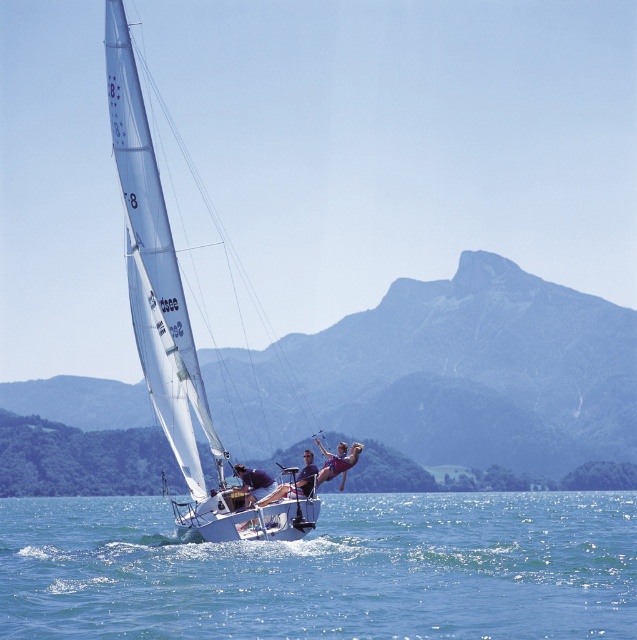
You are standing on the deck of the sailboat and want to reach a point closer to you. Which point should you head towards, point (255,504) or point (266,483)?

Point (255,504) is closer to the viewer, so you should head towards point (255,504).

You are a photographer standing on the dock, and you want to take a photo of the two people on the sailboat. The camera can only focus on objects within a 2.5 meter range. Will both the matte blue swimsuit at center and smooth brown hair at center be in focus?

The distance between the matte blue swimsuit at center and smooth brown hair at center is 2.77 meters, which exceeds the camera focus range of 2.5 meters. Therefore, both cannot be in focus simultaneously.